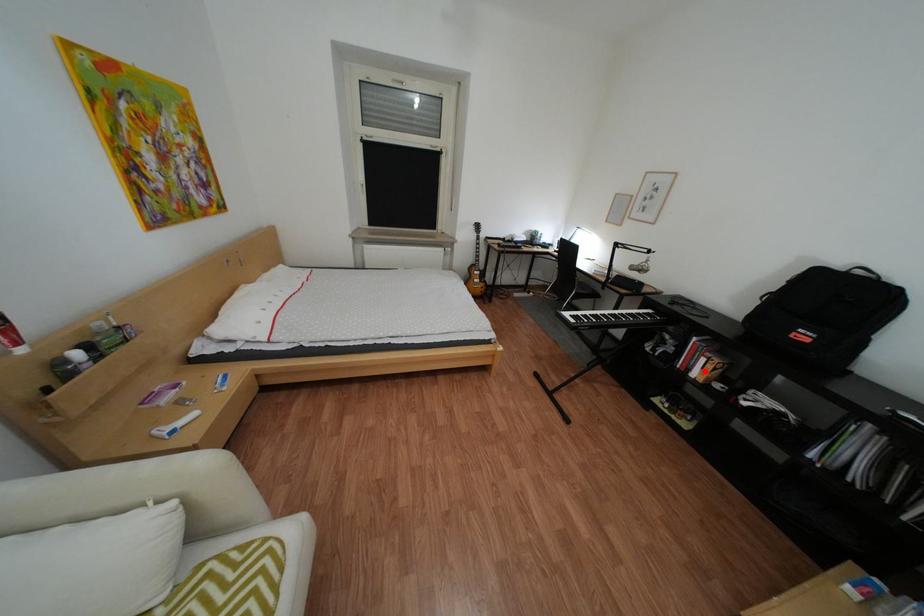
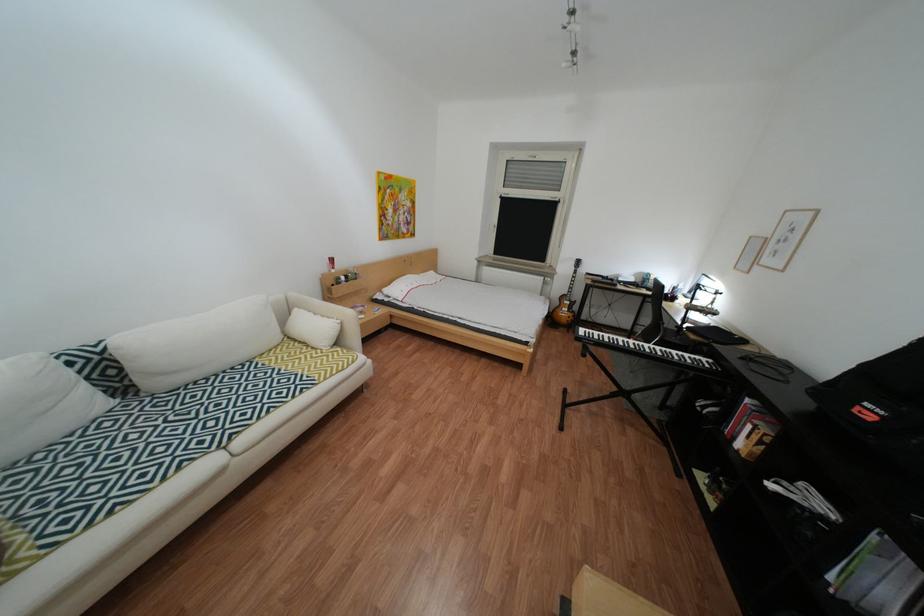
The point at the highlighted location is marked in the first image. Where is the corresponding point in the second image?

(749, 439)